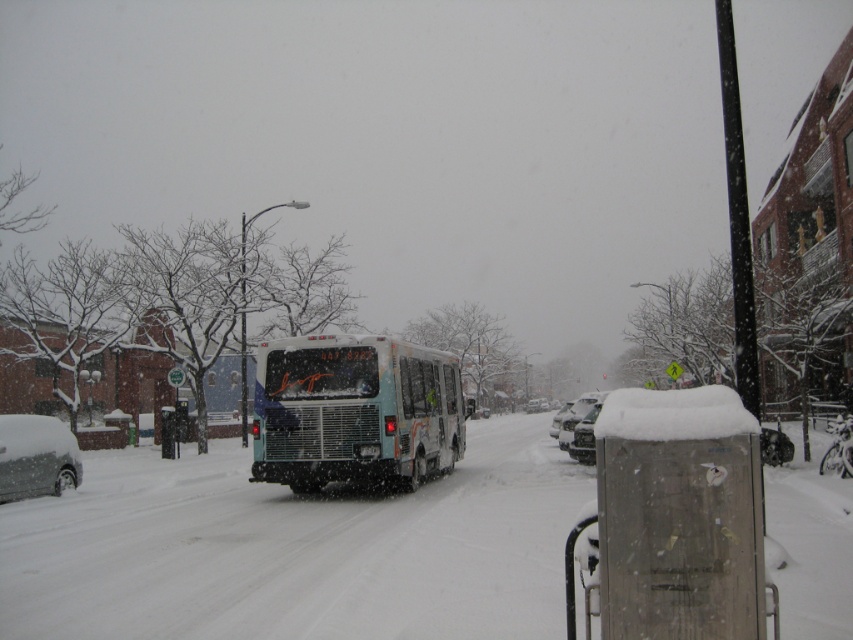
You are a delivery person trying to park your truck between the white matte bus at center and the matte black van at lower left. Can you fit your truck, which is 2.5 meters wide, in the space between them?

The white matte bus at center might be wider than the matte black van at lower left, so the space between them is uncertain. You should check the exact width before attempting to park your truck there.